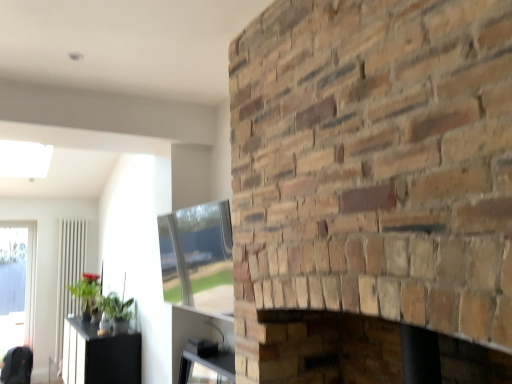
Question: Can you confirm if transparent glass door at left is positioned to the right of green leafy plant at lower left, which ranks as the second plant in left-to-right order?

Choices:
 (A) yes
 (B) no

Answer: (B)

Question: Is transparent glass door at left turned away from green leafy plant at lower left, the first plant when ordered from front to back?

Choices:
 (A) no
 (B) yes

Answer: (A)

Question: Does transparent glass door at left turn towards green leafy plant at lower left, which ranks as the second plant in left-to-right order?

Choices:
 (A) yes
 (B) no

Answer: (B)

Question: Is transparent glass door at left thinner than green leafy plant at lower left, acting as the 1th plant starting from the right?

Choices:
 (A) yes
 (B) no

Answer: (A)

Question: From the image's perspective, does transparent glass door at left appear higher than green leafy plant at lower left, which ranks as the second plant in left-to-right order?

Choices:
 (A) yes
 (B) no

Answer: (B)

Question: Does transparent glass door at left have a lesser height compared to green leafy plant at lower left, the second plant in the back-to-front sequence?

Choices:
 (A) yes
 (B) no

Answer: (B)

Question: From the image's perspective, is dark gray fabric swivel chair at lower left above green matte plant at left, the 2th plant viewed from the right?

Choices:
 (A) no
 (B) yes

Answer: (A)

Question: Is green matte plant at left, the first plant positioned from the back, a part of dark gray fabric swivel chair at lower left?

Choices:
 (A) no
 (B) yes

Answer: (A)

Question: Does dark gray fabric swivel chair at lower left touch green matte plant at left, the 1th plant from the left?

Choices:
 (A) no
 (B) yes

Answer: (A)

Question: Considering the relative positions of dark gray fabric swivel chair at lower left and green matte plant at left, the 1th plant from the left, in the image provided, is dark gray fabric swivel chair at lower left behind green matte plant at left, the 1th plant from the left,?

Choices:
 (A) no
 (B) yes

Answer: (B)

Question: Considering the relative sizes of dark gray fabric swivel chair at lower left and green matte plant at left, the 2th plant positioned from the front, in the image provided, is dark gray fabric swivel chair at lower left taller than green matte plant at left, the 2th plant positioned from the front,?

Choices:
 (A) no
 (B) yes

Answer: (A)

Question: From the image's perspective, would you say dark gray fabric swivel chair at lower left is shown under green matte plant at left, the first plant positioned from the back?

Choices:
 (A) yes
 (B) no

Answer: (A)

Question: Is natural stone fireplace at center turned away from white glossy radiator at left?

Choices:
 (A) yes
 (B) no

Answer: (B)